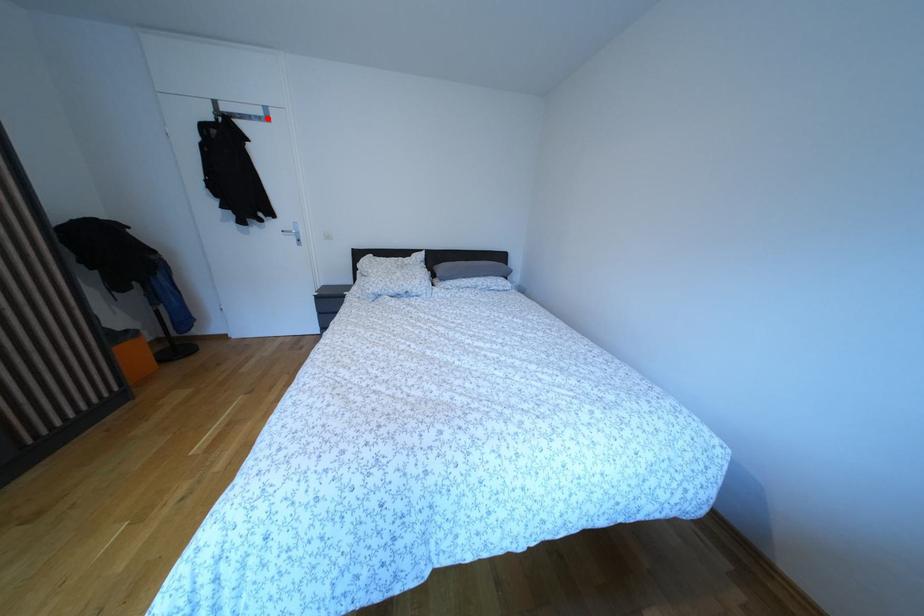
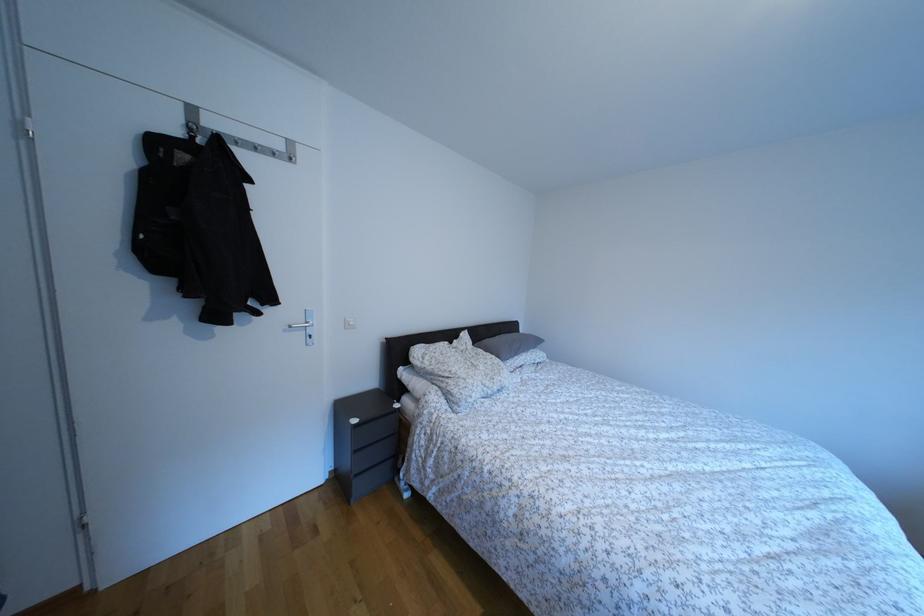
Where in the second image is the point corresponding to the highlighted location from the first image?

(286, 152)